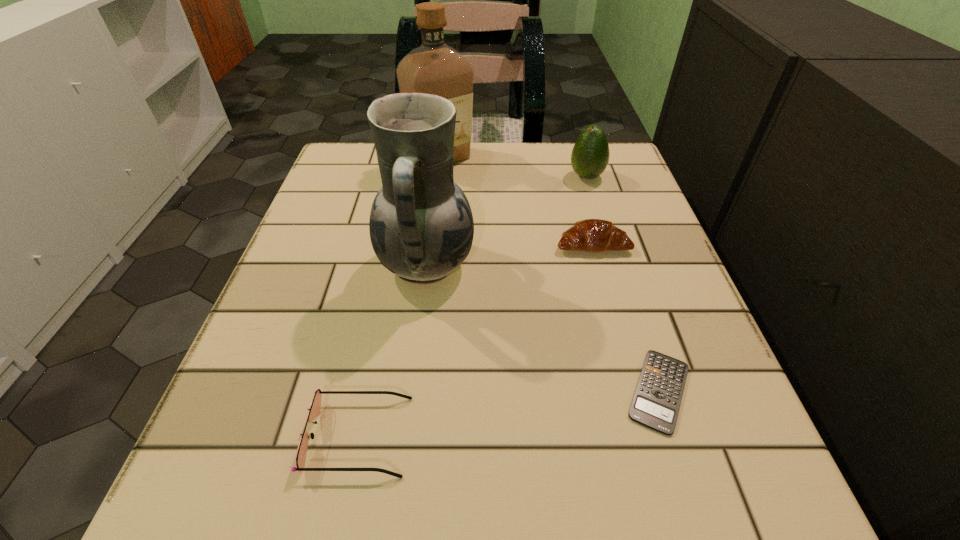
Locate an element on the screen. This screenshot has width=960, height=540. liquor is located at coordinates (435, 68).

Locate an element on the screen. The width and height of the screenshot is (960, 540). pitcher is located at coordinates (421, 226).

Where is `the third tallest object`? This screenshot has width=960, height=540. the third tallest object is located at coordinates (590, 155).

Locate an element on the screen. Image resolution: width=960 pixels, height=540 pixels. the third shortest object is located at coordinates (595, 235).

What are the coordinates of `the second shortest object` in the screenshot? It's located at (314, 409).

Locate an element on the screen. The image size is (960, 540). calculator is located at coordinates (656, 402).

In order to click on vacant space located 0.130m on the front-facing side of the liquor in this screenshot , I will do `click(435, 210)`.

Where is `blank area located 0.120m on the front-facing side of the pitcher`? blank area located 0.120m on the front-facing side of the pitcher is located at coordinates (542, 265).

The height and width of the screenshot is (540, 960). In order to click on free point located 0.100m on the back of the third tallest object in this screenshot , I will do `click(577, 145)`.

Locate an element on the screen. This screenshot has width=960, height=540. blank area located on the front of the crescent roll is located at coordinates (652, 461).